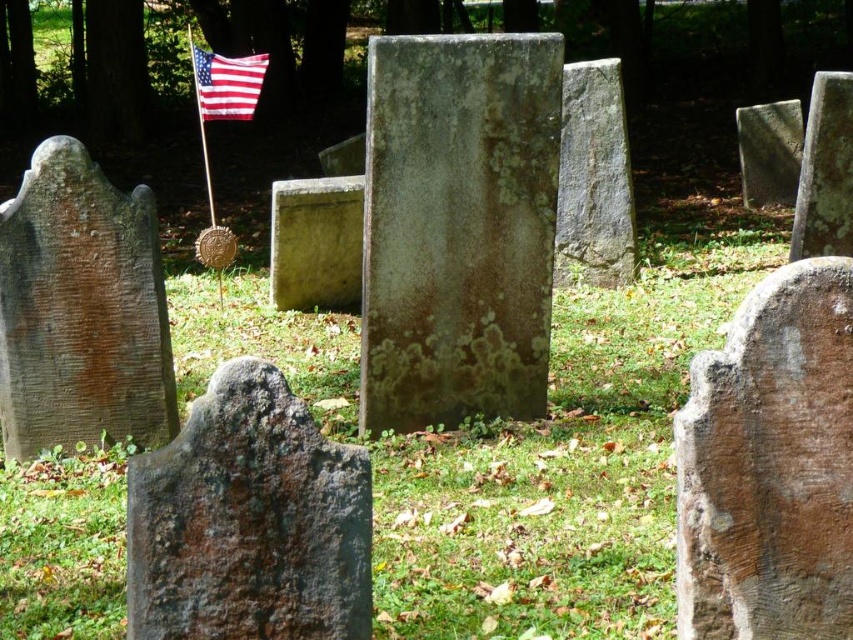
You are a groundskeeper at the cemetery and need to replace the flagpole. The flagpole must be placed so it doesn not block the view of the gravestones. Given the sizes of the brown rough stone gravestone at right and the rusty stone gravestone at center, which gravestone should the flagpole be placed closer to?

The flagpole should be placed closer to the rusty stone gravestone at center because the brown rough stone gravestone at right is taller, so placing the flagpole near the shorter rusty stone gravestone at center would prevent blocking the view of the taller gravestone.

You are standing at the center of the cemetery and want to place a new flower at the base of the brown rough stone gravestone at right. Given that your current position is at coordinates 0,0, and the cemetery layout is represented on a coordinate plane where the gravestone is at point 0.728,0.904, what direction should you move to reach it?

To reach the brown rough stone gravestone at right located at coordinates [770,465] from your current position at [0,0], you should move northeast since the x and y coordinates are both positive, indicating a diagonal direction towards the upper right.

You are a visitor at the cemetery and want to place a bouquet of flowers between the brown stone gravestone at left and the american flag at upper left. Given that the bouquet is 1.2 meters wide, can you determine if there is enough space between them to place the bouquet?

The brown stone gravestone at left is larger in size compared to the american flag at upper left. However, the exact distance between them is not provided, so it is unclear if there is enough space to place the bouquet.